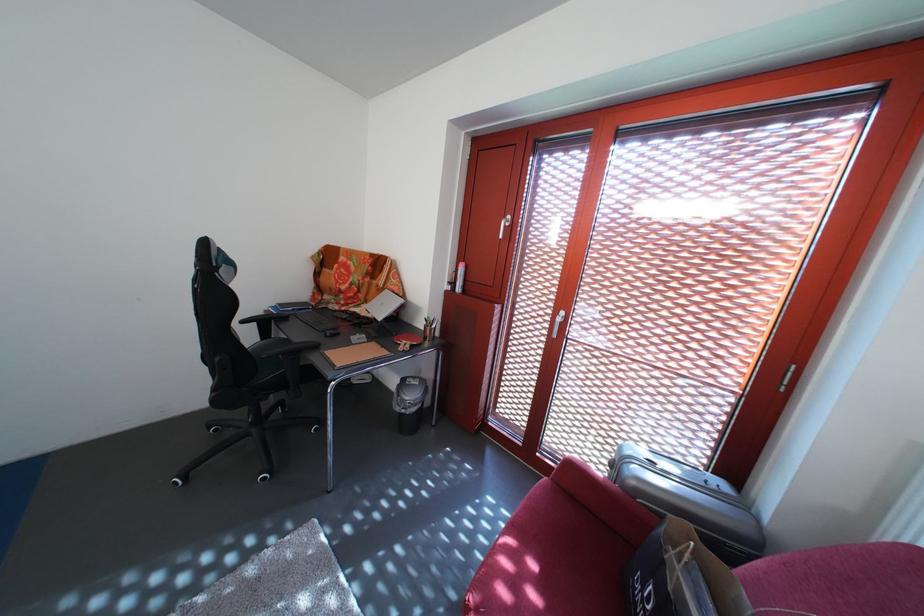
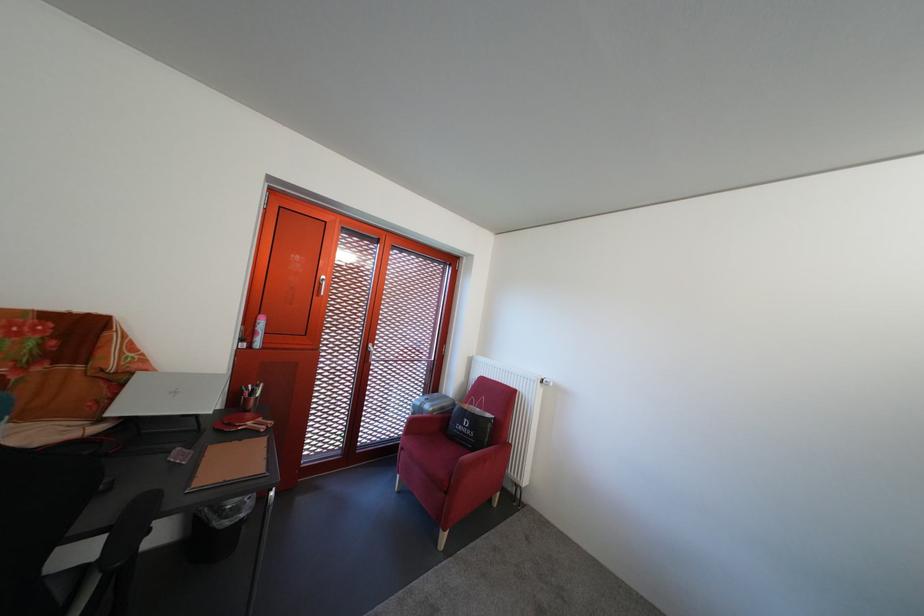
Find the pixel in the second image that matches (x=460, y=290) in the first image.

(252, 346)